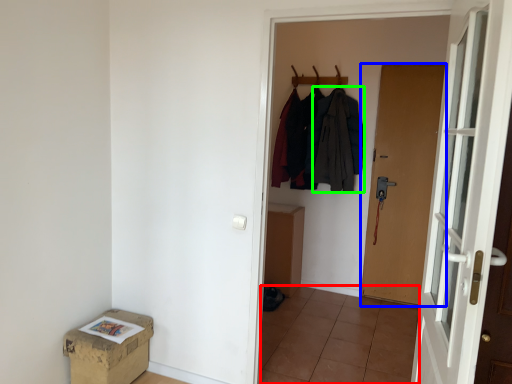
Question: Which object is the farthest from tile (highlighted by a red box)? Choose among these: door (highlighted by a blue box) or clothing (highlighted by a green box).

Choices:
 (A) door
 (B) clothing

Answer: (B)